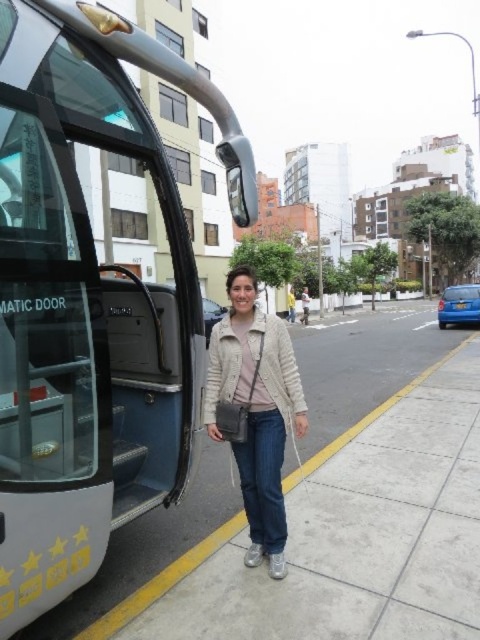
Question: Which object is closer to the camera taking this photo?

Choices:
 (A) light beige textured jacket at center
 (B) metallic silver tour bus at center

Answer: (B)

Question: Does metallic silver tour bus at center appear over light beige textured jacket at center?

Choices:
 (A) yes
 (B) no

Answer: (A)

Question: Which point is farther from the camera taking this photo?

Choices:
 (A) (45, 424)
 (B) (253, 385)

Answer: (B)

Question: Among these points, which one is nearest to the camera?

Choices:
 (A) tap(255, 332)
 (B) tap(200, 292)

Answer: (A)

Question: Can you confirm if metallic silver tour bus at center is wider than light beige textured jacket at center?

Choices:
 (A) yes
 (B) no

Answer: (A)

Question: Is the position of metallic silver tour bus at center more distant than that of light beige textured jacket at center?

Choices:
 (A) no
 (B) yes

Answer: (A)